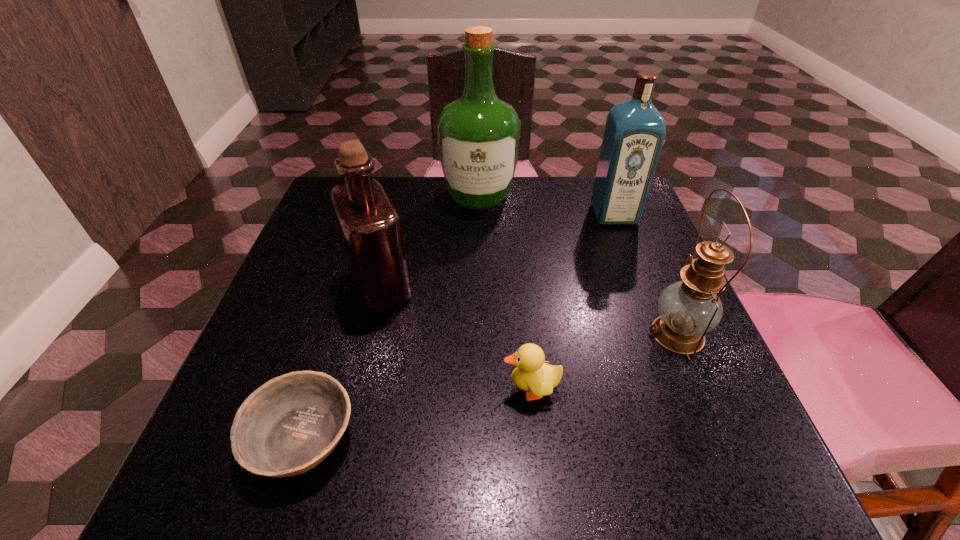
At what (x,y) coordinates should I click in order to perform the action: click on free space between the tallest object and the duckling. Please return your answer as a coordinate pair (x, y). This screenshot has height=540, width=960. Looking at the image, I should click on pos(505,293).

You are a GUI agent. You are given a task and a screenshot of the screen. Output one action in this format:
    pyautogui.click(x=<x>, y=<y>)
    Task: Click on the vacant region between the oil lamp and the bowl
    
    Given the screenshot: What is the action you would take?
    pyautogui.click(x=490, y=386)

What are the coordinates of `vacant space in between the duckling and the leftmost liquor` in the screenshot? It's located at (455, 339).

Locate an element on the screen. The image size is (960, 540). vacant area that lies between the nearest liquor and the oil lamp is located at coordinates (529, 311).

I want to click on vacant area that lies between the oil lamp and the rightmost liquor, so click(646, 274).

Where is `free area in between the bowl and the leftmost liquor`? The height and width of the screenshot is (540, 960). free area in between the bowl and the leftmost liquor is located at coordinates 341,362.

At what (x,y) coordinates should I click in order to perform the action: click on free space between the bowl and the tallest liquor. Please return your answer as a coordinate pair (x, y). The width and height of the screenshot is (960, 540). Looking at the image, I should click on (391, 317).

What are the coordinates of `object that can be found as the third closest to the oil lamp` in the screenshot? It's located at (478, 134).

Locate an element on the screen. The image size is (960, 540). the fifth closest object to the rightmost liquor is located at coordinates [286, 427].

Identify the location of liquor that stands as the third closest to the fifth tallest object. (478, 134).